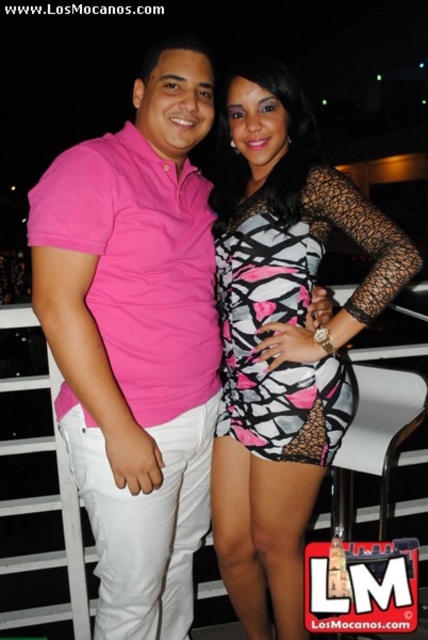
Question: Which point is farther from the camera taking this photo?

Choices:
 (A) (282, 460)
 (B) (213, 220)

Answer: (B)

Question: Which of the following is the closest to the observer?

Choices:
 (A) (265, 378)
 (B) (204, 420)
 (C) (243, 392)

Answer: (A)

Question: Is pink cotton polo shirt at left smaller than zebra-patterned fabric dress at center?

Choices:
 (A) yes
 (B) no

Answer: (B)

Question: Is pink cotton polo shirt at left thinner than pink and white geometric dress at center?

Choices:
 (A) yes
 (B) no

Answer: (A)

Question: Which object is the closest to the pink and white geometric dress at center?

Choices:
 (A) zebra-patterned fabric dress at center
 (B) pink cotton polo shirt at left

Answer: (A)

Question: Does pink cotton polo shirt at left lie behind pink and white geometric dress at center?

Choices:
 (A) no
 (B) yes

Answer: (A)